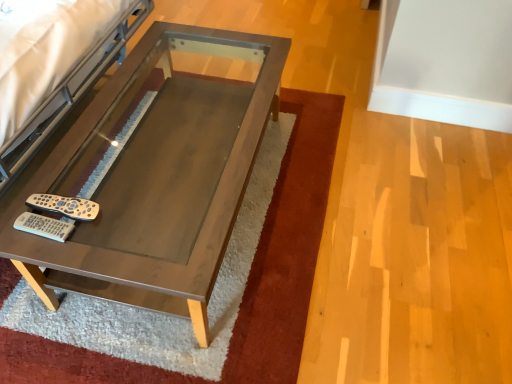
Question: Is matte wood table at center positioned behind silver metallic remote at lower left?

Choices:
 (A) no
 (B) yes

Answer: (A)

Question: Can you confirm if matte wood table at center is thinner than silver metallic remote at lower left?

Choices:
 (A) no
 (B) yes

Answer: (A)

Question: Considering the relative sizes of matte wood table at center and silver metallic remote at lower left in the image provided, is matte wood table at center wider than silver metallic remote at lower left?

Choices:
 (A) yes
 (B) no

Answer: (A)

Question: Considering the relative sizes of matte wood table at center and silver metallic remote at lower left in the image provided, is matte wood table at center taller than silver metallic remote at lower left?

Choices:
 (A) yes
 (B) no

Answer: (A)

Question: From the image's perspective, is matte wood table at center below silver metallic remote at lower left?

Choices:
 (A) no
 (B) yes

Answer: (A)

Question: Is the position of matte wood table at center less distant than that of silver metallic remote at lower left?

Choices:
 (A) yes
 (B) no

Answer: (A)

Question: Considering the relative sizes of silver metallic remote at lower left and matte wood table at center in the image provided, is silver metallic remote at lower left wider than matte wood table at center?

Choices:
 (A) no
 (B) yes

Answer: (A)

Question: From the image's perspective, is silver metallic remote at lower left located beneath matte wood table at center?

Choices:
 (A) no
 (B) yes

Answer: (B)

Question: Is silver metallic remote at lower left looking in the opposite direction of matte wood table at center?

Choices:
 (A) yes
 (B) no

Answer: (B)

Question: Is silver metallic remote at lower left aimed at matte wood table at center?

Choices:
 (A) yes
 (B) no

Answer: (B)

Question: Can you confirm if silver metallic remote at lower left is positioned to the left of matte wood table at center?

Choices:
 (A) yes
 (B) no

Answer: (A)

Question: Can you confirm if silver metallic remote at lower left is smaller than matte wood table at center?

Choices:
 (A) no
 (B) yes

Answer: (B)

Question: Considering their positions, is silver metallic remote at lower left located in front of or behind matte wood table at center?

Choices:
 (A) behind
 (B) front

Answer: (A)